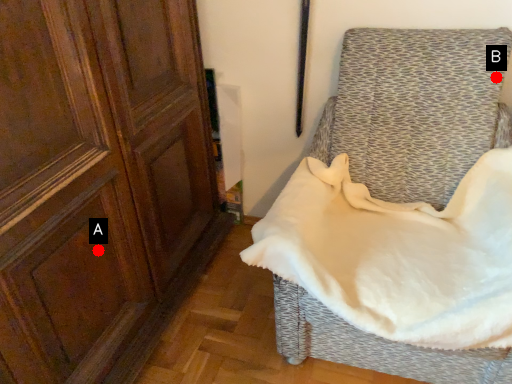
Question: Two points are circled on the image, labeled by A and B beside each circle. Among these points, which one is farthest from the camera?

Choices:
 (A) A is further
 (B) B is further

Answer: (B)